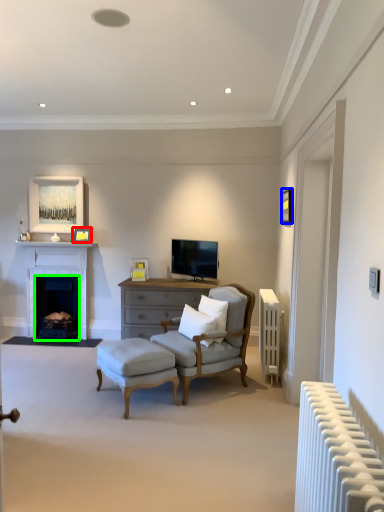
Question: Estimate the real-world distances between objects in this image. Which object is closer to picture frame (highlighted by a red box), picture frame (highlighted by a blue box) or fireplace (highlighted by a green box)?

Choices:
 (A) picture frame
 (B) fireplace

Answer: (B)